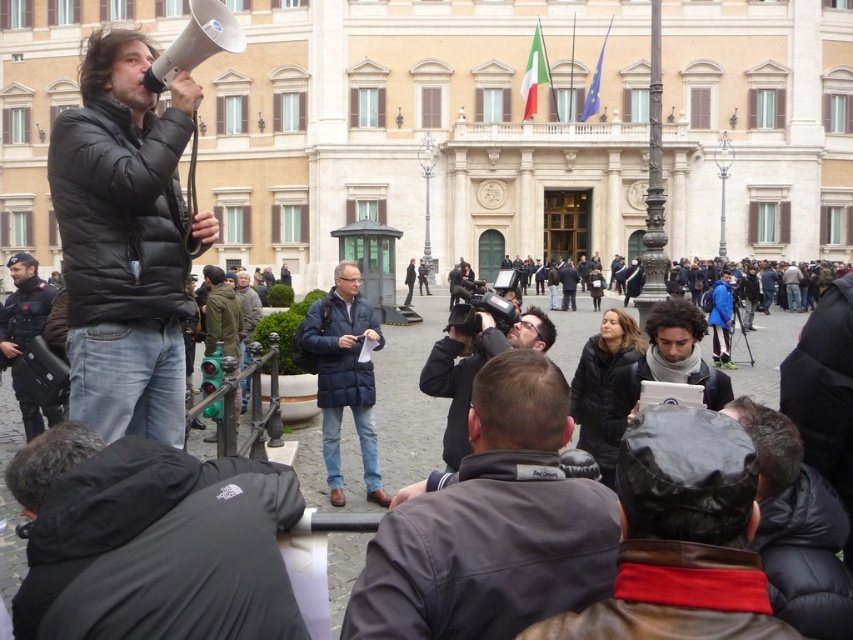
Is point (770, 481) behind point (647, 356)?

No, it is in front of (647, 356).

In the scene shown: Who is higher up, black matte jacket at lower right or matte black jacket at center?

Positioned higher is matte black jacket at center.

Between point (778, 492) and point (664, 317), which one is positioned behind?

The point (664, 317) is behind.

This screenshot has height=640, width=853. Find the location of `black matte jacket at lower right`. black matte jacket at lower right is located at coordinates (796, 528).

Which is more to the right, leather jacket at center or gray woolen sweater at center?

leather jacket at center is more to the right.

Can you confirm if leather jacket at center is shorter than gray woolen sweater at center?

Yes, leather jacket at center is shorter than gray woolen sweater at center.

Between point (705, 592) and point (241, 355), which one is positioned in front?

Point (705, 592) is more forward.

Find the location of a particular element. The height and width of the screenshot is (640, 853). leather jacket at center is located at coordinates (682, 538).

Does matte black jacket at left have a greater height compared to matte black jacket at center?

Indeed, matte black jacket at left has a greater height compared to matte black jacket at center.

Is matte black jacket at left bigger than matte black jacket at center?

Correct, matte black jacket at left is larger in size than matte black jacket at center.

Which is behind, point (202, 237) or point (612, 396)?

The point (612, 396) is behind.

Identify the location of matte black jacket at left. (123, 241).